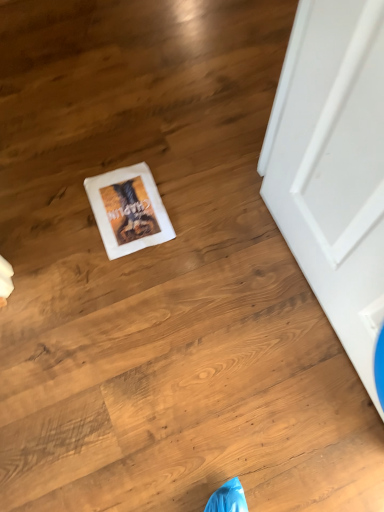
You are a GUI agent. You are given a task and a screenshot of the screen. Output one action in this format:
    pyautogui.click(x=<x>, y=<y>)
    Task: Click on the empty space that is ontop of white paper postcard at center (from a real-world perspective)
    This screenshot has height=512, width=384.
    Given the screenshot: What is the action you would take?
    pyautogui.click(x=125, y=209)